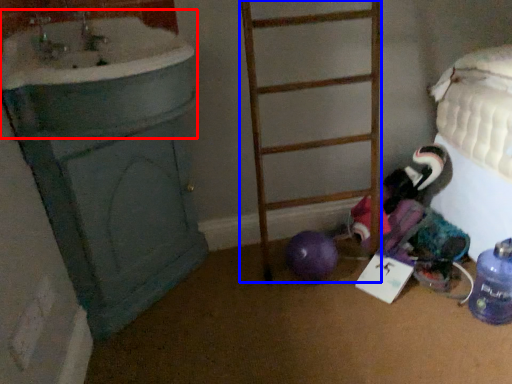
Question: Which point is closer to the camera, sink (highlighted by a red box) or ladder (highlighted by a blue box)?

Choices:
 (A) sink
 (B) ladder

Answer: (A)